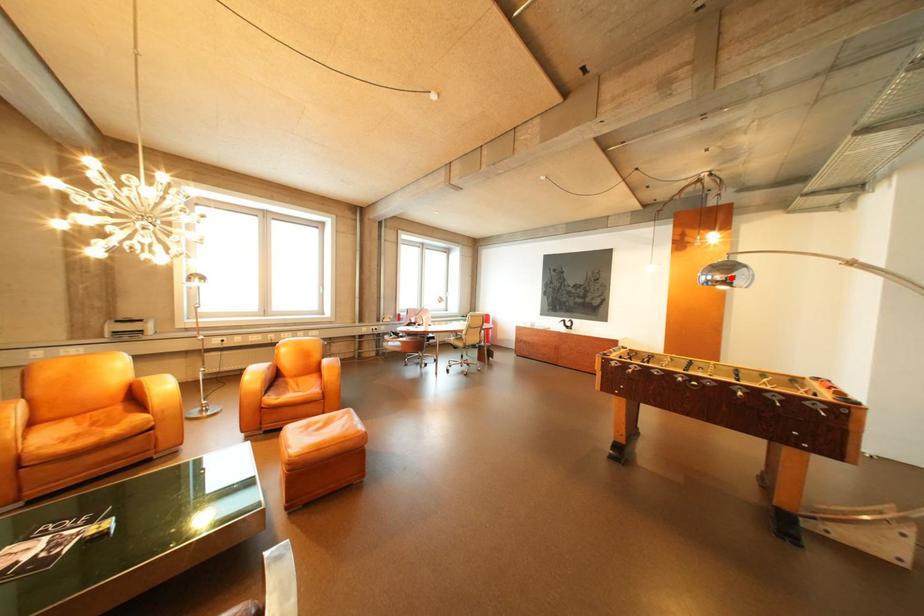
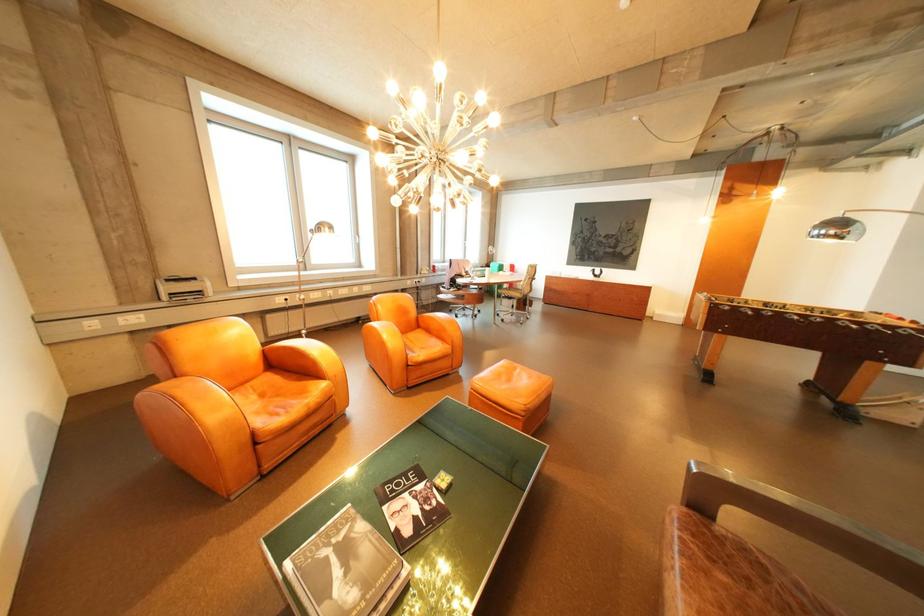
Locate, in the second image, the point that corresponds to the highlighted location in the first image.

(846, 233)